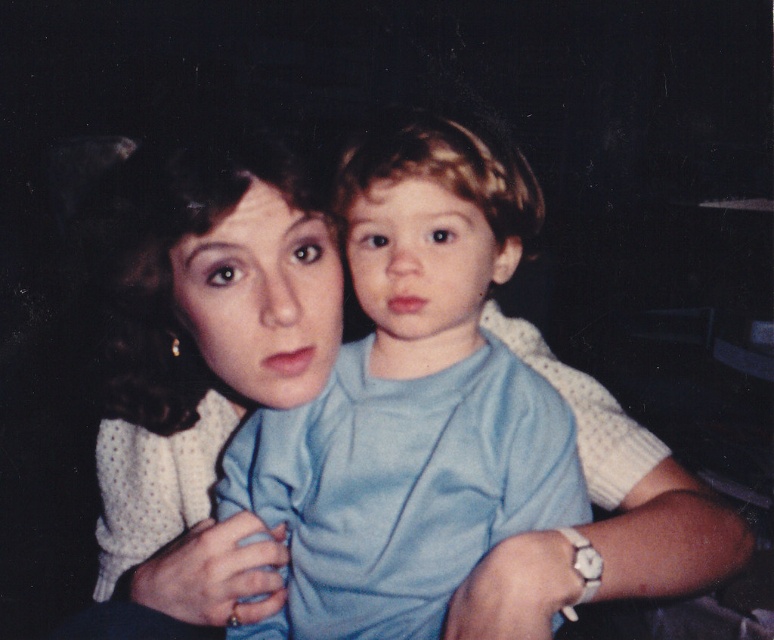
You are standing in front of the scene and want to know which of the two points, point (x=483, y=198) or point (x=108, y=588), is nearer to you. Can you determine this based on their positions?

Point (x=483, y=198) is closer to the camera than point (x=108, y=588), so it is nearer to you.

You are an interior designer assessing the spatial arrangement of clothing items in a photo. The scene shows a woman holding a child wearing a light blue cotton shirt at center and a white dotted sweater at upper left. Based on the visual hierarchy, which clothing item takes up more visual space in the image?

The white dotted sweater at upper left occupies more visual space than the light blue cotton shirt at center.

You are a tailor measuring the distance between two garments in a photo. The light blue cotton shirt at center and the white dotted sweater at upper left are displayed. Can the tailor fit a 3.5 inch wide decorative ribbon between them without overlapping?

The distance between the light blue cotton shirt at center and the white dotted sweater at upper left is 4.06 inches. Since the ribbon is 3.5 inches wide, it can fit between them as the space is wider than the ribbon.